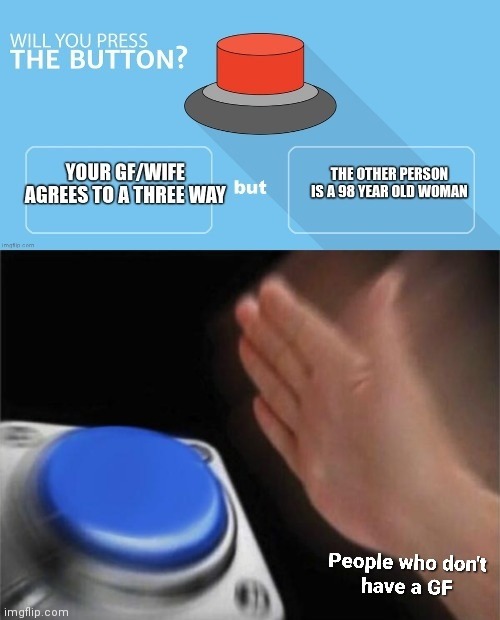
The image size is (500, 620). Identify the location of screws. (260, 591), (202, 450), (25, 435), (36, 595).